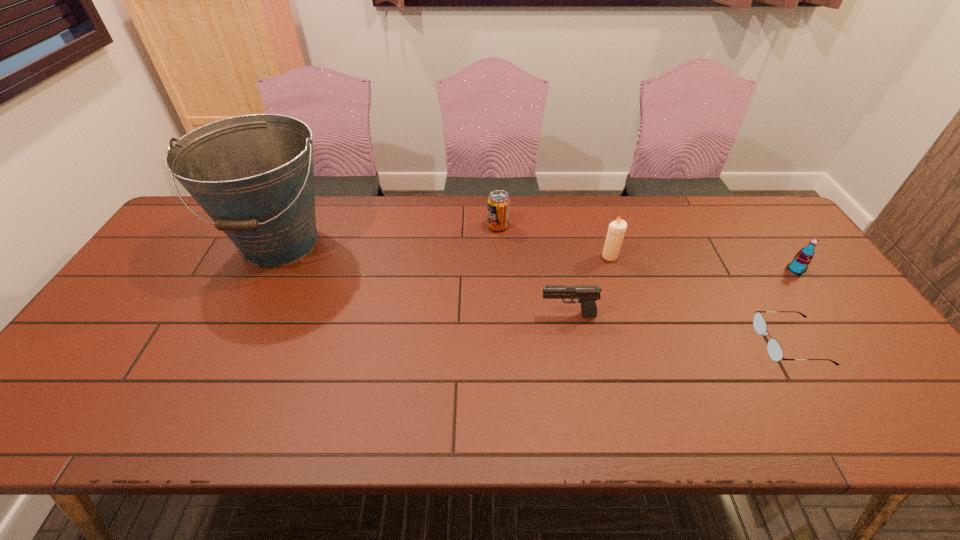
In the image, there is a desktop. At what (x,y) coordinates should I click in order to perform the action: click on vacant space at the far left corner. Please return your answer as a coordinate pair (x, y). Image resolution: width=960 pixels, height=540 pixels. Looking at the image, I should click on (207, 219).

In the image, there is a desktop. At what (x,y) coordinates should I click in order to perform the action: click on vacant space at the far right corner. Please return your answer as a coordinate pair (x, y). Looking at the image, I should click on (744, 232).

Locate an element on the screen. free space between the tallest object and the right soda is located at coordinates (539, 256).

The image size is (960, 540). I want to click on vacant space in between the fourth object from left to right and the rightmost object, so click(703, 263).

The height and width of the screenshot is (540, 960). In order to click on empty location between the candle and the tallest object in this screenshot , I will do `click(445, 249)`.

Where is `empty location between the bucket and the third object from right to left`? The height and width of the screenshot is (540, 960). empty location between the bucket and the third object from right to left is located at coordinates (445, 249).

Find the location of a particular element. This screenshot has width=960, height=540. free space between the fourth object from right to left and the farther soda is located at coordinates (533, 271).

What are the coordinates of `vacant area that lies between the second nearest object and the tallest object` in the screenshot? It's located at (424, 279).

Identify the location of vacant point located between the rightmost object and the second object from left to right. (647, 248).

You are a GUI agent. You are given a task and a screenshot of the screen. Output one action in this format:
    pyautogui.click(x=<x>, y=<y>)
    Task: Click on the unoccupied area between the pistol and the shortest object
    The height and width of the screenshot is (540, 960).
    Given the screenshot: What is the action you would take?
    pyautogui.click(x=679, y=329)